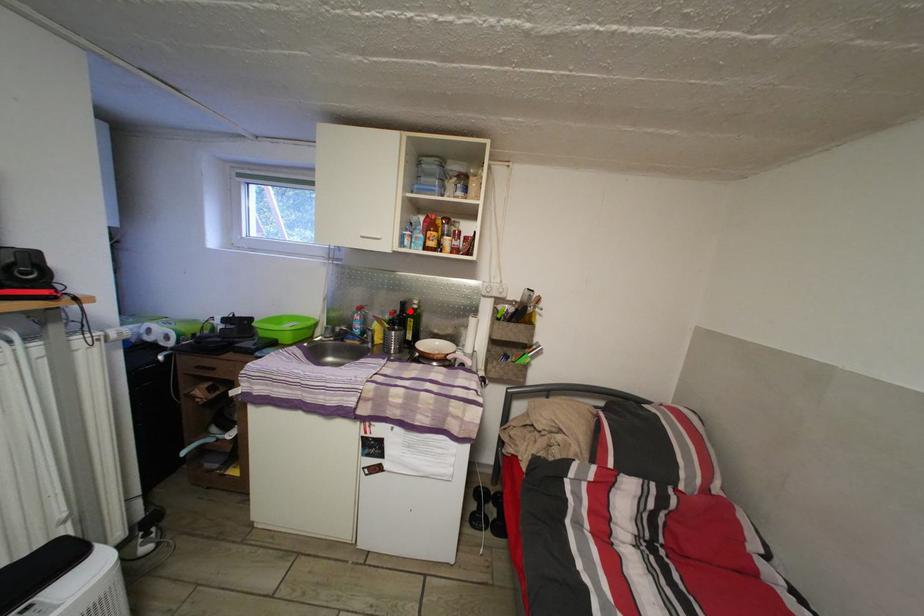
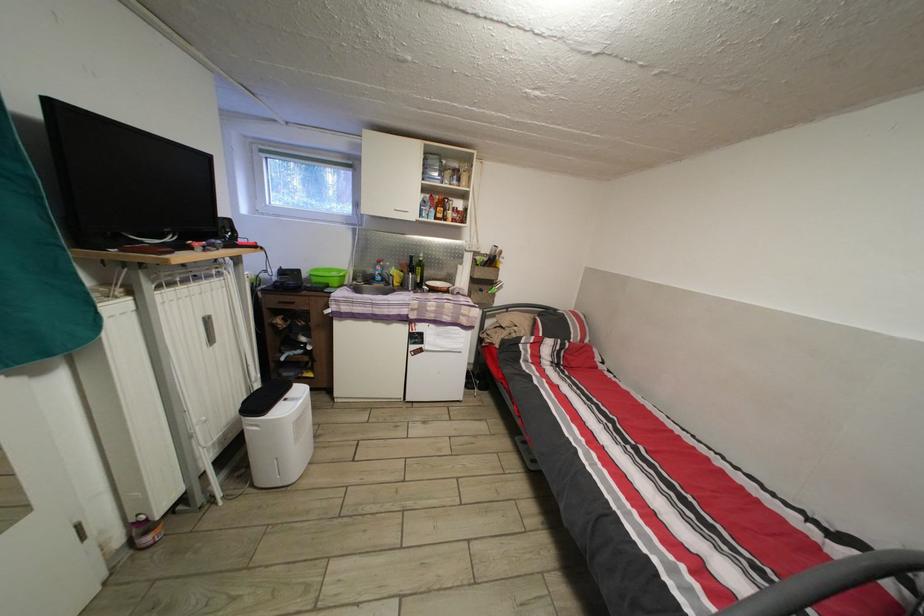
The point at the highlighted location is marked in the first image. Where is the corresponding point in the second image?

(419, 265)